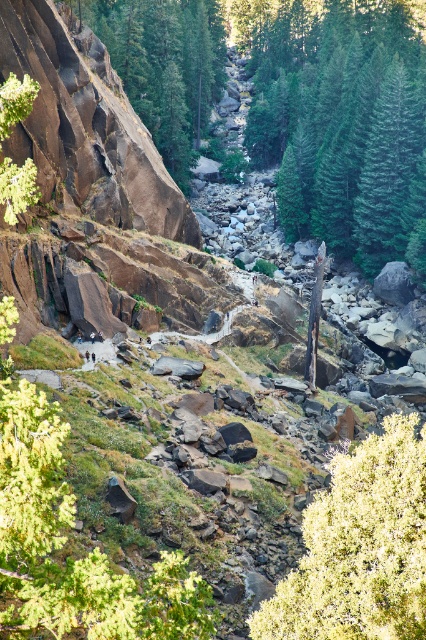
You are a hiker trying to navigate the steep slope. You see the green fuzzy bush at lower right and the brown rough rock at left. Which object is positioned to the right side of the other?

The green fuzzy bush at lower right is positioned to the right of the brown rough rock at left.

Imagine you are standing at the starting point of the dirt path in the image. You see two points marked as point (357, 122) and point (189, 147). Which point would you reach first as you walk along the path?

Point (357, 122) is in front of point (189, 147), so you would reach point (357, 122) first as you walk along the path.

You are a hiker standing at the bottom of the steep, rocky slope in the foreground. You want to reach the valley below via the winding dirt path. Which direction should you head to avoid the green textured tree at center?

The green textured tree at center is located at coordinates point [345,125]. Since you are at the bottom of the steep, rocky slope in the foreground, you should head towards the valley below by following the winding dirt path which is positioned away from the tree.